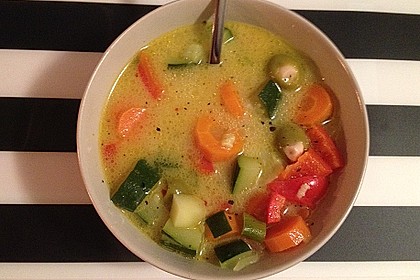
The height and width of the screenshot is (280, 420). Identify the location of bowl. (96, 94), (345, 189).